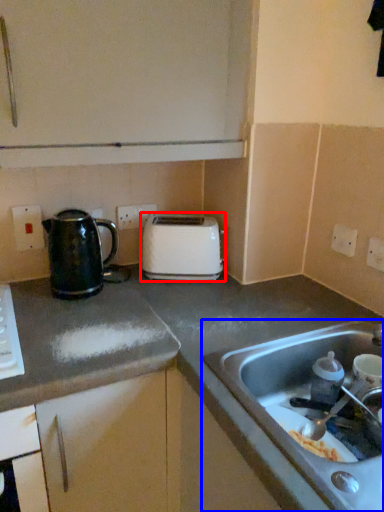
Question: Which object is further to the camera taking this photo, toaster (highlighted by a red box) or sink (highlighted by a blue box)?

Choices:
 (A) toaster
 (B) sink

Answer: (A)